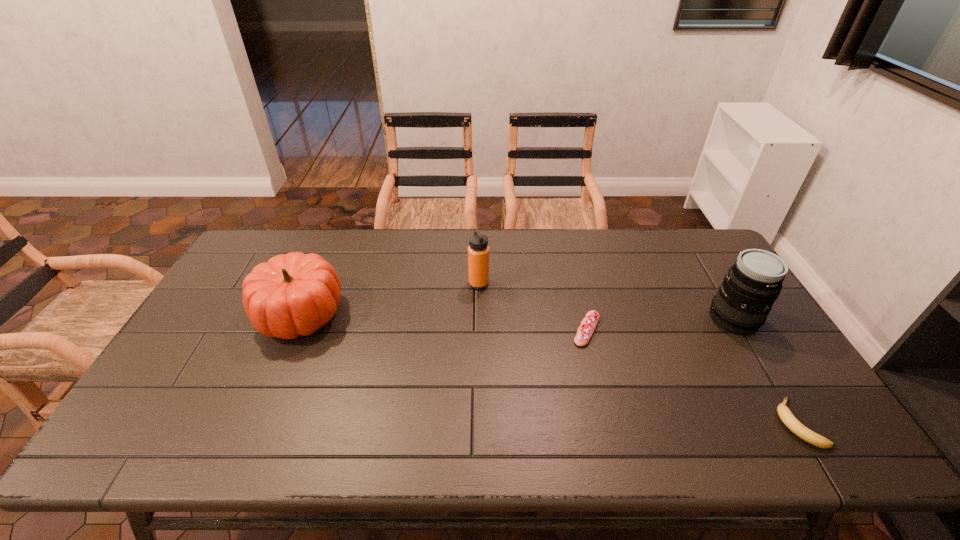
This screenshot has width=960, height=540. Find the location of `free spot between the shortest object and the eclair`. free spot between the shortest object and the eclair is located at coordinates (692, 376).

You are a GUI agent. You are given a task and a screenshot of the screen. Output one action in this format:
    pyautogui.click(x=<x>, y=<y>)
    Task: Click on the free spot between the thermos bottle and the banana
    The height and width of the screenshot is (540, 960).
    Given the screenshot: What is the action you would take?
    pyautogui.click(x=638, y=353)

Find the location of `object that is the fourth closest one to the thermos bottle`. object that is the fourth closest one to the thermos bottle is located at coordinates (791, 422).

This screenshot has height=540, width=960. I want to click on object that is the fourth closest one to the banana, so click(x=293, y=294).

In order to click on vacant space that satisfies the following two spatial constraints: 1. on the front side of the nearest object; 2. on the right side of the thermos bottle in this screenshot , I will do `click(478, 423)`.

Locate an element on the screen. The height and width of the screenshot is (540, 960). free space that satisfies the following two spatial constraints: 1. on the back side of the second shortest object; 2. on the left side of the telephoto lens is located at coordinates (584, 319).